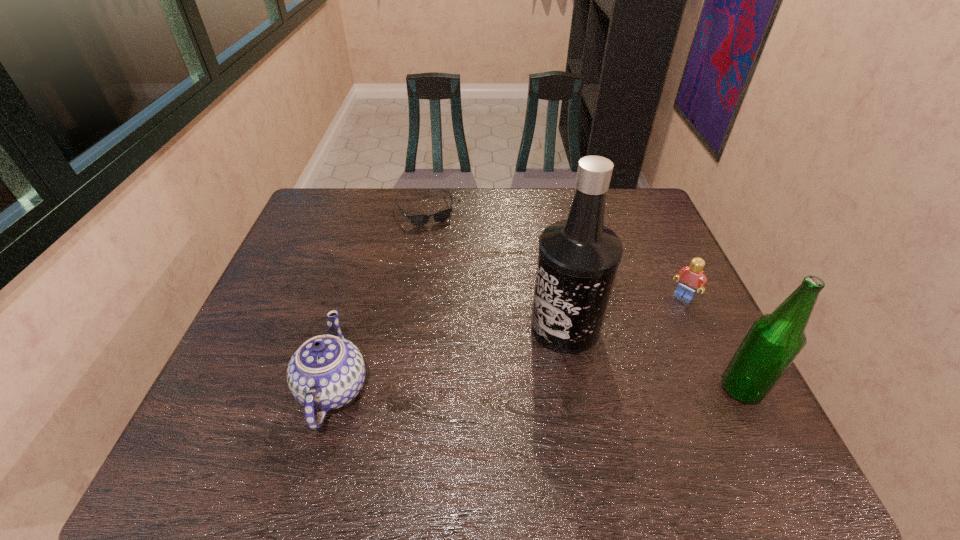
Locate an element on the screen. The image size is (960, 540). beer bottle that is at the right edge is located at coordinates (773, 342).

Where is `Lego that is at the right edge`? The height and width of the screenshot is (540, 960). Lego that is at the right edge is located at coordinates (690, 278).

The height and width of the screenshot is (540, 960). I want to click on object at the near right corner, so click(773, 342).

This screenshot has width=960, height=540. I want to click on vacant space at the far edge of the desktop, so click(455, 193).

Locate an element on the screen. The image size is (960, 540). free region at the near edge is located at coordinates (499, 419).

This screenshot has height=540, width=960. In the image, there is a desktop. Find the location of `free space at the right edge`. free space at the right edge is located at coordinates (652, 285).

Locate an element on the screen. vacant region at the near left corner is located at coordinates pyautogui.click(x=269, y=419).

In the image, there is a desktop. Find the location of `vacant space at the far right corner`. vacant space at the far right corner is located at coordinates (643, 218).

Find the location of a particular element. vacant space at the near right corner of the desktop is located at coordinates (703, 417).

Find the location of a particular element. This screenshot has height=540, width=960. unoccupied area between the tallest object and the third tallest object is located at coordinates (449, 358).